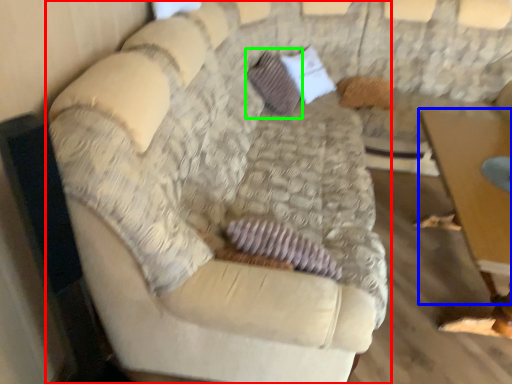
Question: Considering the real-world distances, which object is farthest from studio couch (highlighted by a red box)? table (highlighted by a blue box) or pillow (highlighted by a green box)?

Choices:
 (A) table
 (B) pillow

Answer: (B)